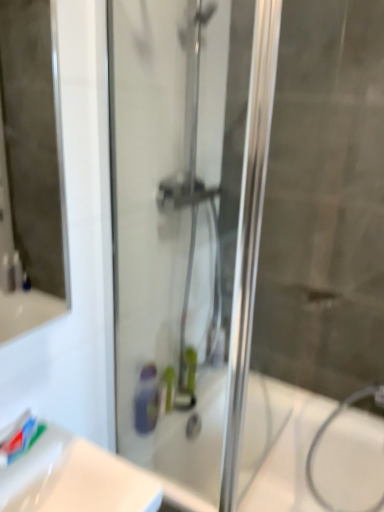
Question: Could you tell me if white glossy bath at center is facing white matte toothpaste at lower left?

Choices:
 (A) no
 (B) yes

Answer: (A)

Question: Is white glossy bath at center far from white matte toothpaste at lower left?

Choices:
 (A) no
 (B) yes

Answer: (A)

Question: Is white glossy bath at center outside of white matte toothpaste at lower left?

Choices:
 (A) no
 (B) yes

Answer: (B)

Question: Is white glossy bath at center placed right next to white matte toothpaste at lower left?

Choices:
 (A) no
 (B) yes

Answer: (A)

Question: Considering the relative sizes of white glossy bath at center and white matte toothpaste at lower left in the image provided, is white glossy bath at center taller than white matte toothpaste at lower left?

Choices:
 (A) yes
 (B) no

Answer: (A)

Question: Is white glossy bath at center bigger or smaller than transparent glass shower door at center?

Choices:
 (A) small
 (B) big

Answer: (B)

Question: From the image's perspective, is white glossy bath at center above or below transparent glass shower door at center?

Choices:
 (A) below
 (B) above

Answer: (A)

Question: From a real-world perspective, is white glossy bath at center positioned above or below transparent glass shower door at center?

Choices:
 (A) above
 (B) below

Answer: (B)

Question: Considering the positions of white glossy bath at center and transparent glass shower door at center in the image, is white glossy bath at center wider or thinner than transparent glass shower door at center?

Choices:
 (A) wide
 (B) thin

Answer: (A)

Question: Considering the positions of white glossy bath at center and white matte toothpaste at lower left in the image, is white glossy bath at center bigger or smaller than white matte toothpaste at lower left?

Choices:
 (A) big
 (B) small

Answer: (A)

Question: From the image's perspective, is white glossy bath at center positioned above or below white matte toothpaste at lower left?

Choices:
 (A) above
 (B) below

Answer: (B)

Question: Is white glossy bath at center inside the boundaries of white matte toothpaste at lower left, or outside?

Choices:
 (A) outside
 (B) inside

Answer: (A)

Question: In the image, is white glossy bath at center on the left side or the right side of white matte toothpaste at lower left?

Choices:
 (A) left
 (B) right

Answer: (B)

Question: Based on their positions, is white glossy sink at lower left located to the left or right of white matte toothpaste at lower left?

Choices:
 (A) right
 (B) left

Answer: (A)

Question: From the image's perspective, is white glossy sink at lower left positioned above or below white matte toothpaste at lower left?

Choices:
 (A) above
 (B) below

Answer: (B)